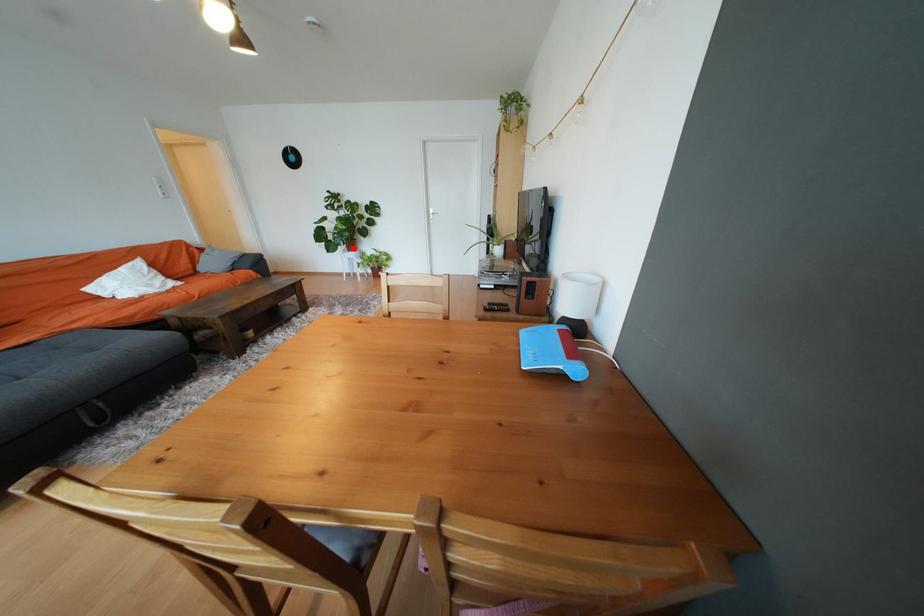
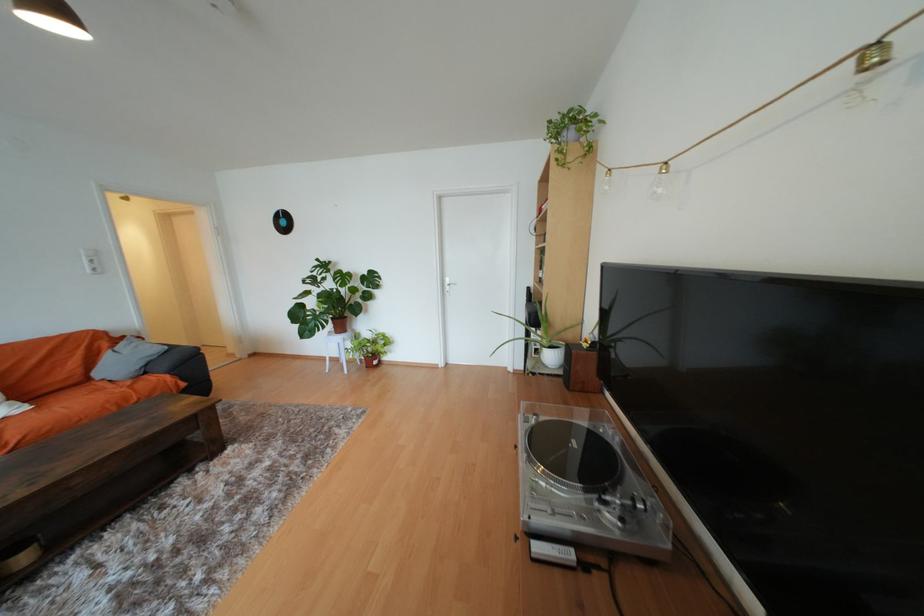
The point at the highlighted location is marked in the first image. Where is the corresponding point in the second image?

(341, 329)